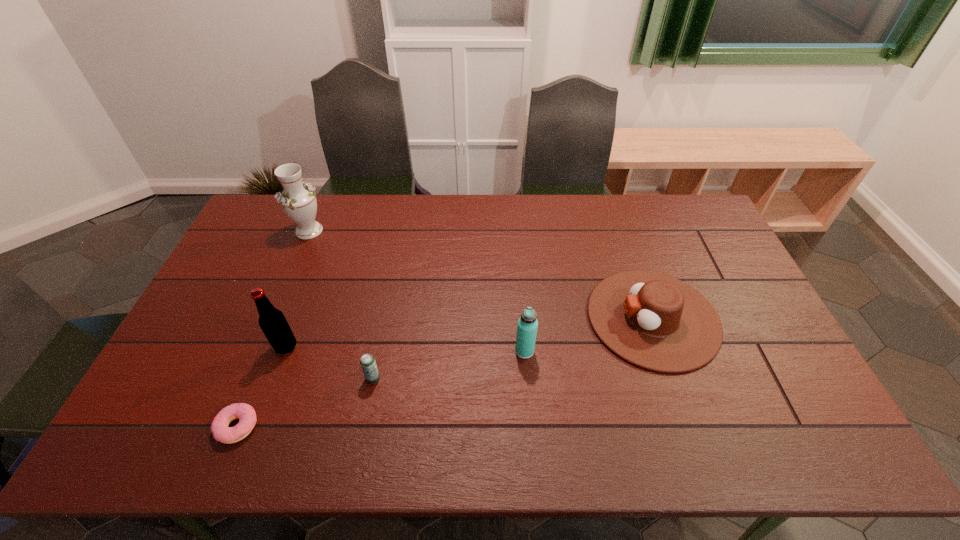
Locate an element on the screen. free spot that satisfies the following two spatial constraints: 1. on the front side of the vase; 2. on the right side of the fourth object from left to right is located at coordinates (248, 379).

The image size is (960, 540). In order to click on free location that satisfies the following two spatial constraints: 1. on the front-facing side of the rightmost object; 2. on the front side of the beer bottle in this screenshot , I will do `click(662, 347)`.

In order to click on vacant space that satisfies the following two spatial constraints: 1. on the front side of the fifth object from left to right; 2. on the left side of the beer bottle in this screenshot , I will do `click(284, 351)`.

Where is `free location that satisfies the following two spatial constraints: 1. on the front side of the thermos bottle; 2. on the right side of the beer bottle`? This screenshot has height=540, width=960. free location that satisfies the following two spatial constraints: 1. on the front side of the thermos bottle; 2. on the right side of the beer bottle is located at coordinates (284, 351).